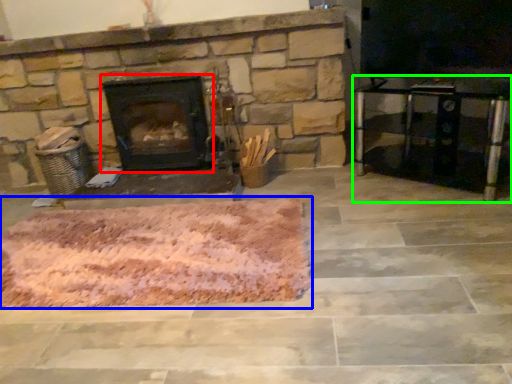
Question: Estimate the real-world distances between objects in this image. Which object is farther from wood burning stove (highlighted by a red box), mat (highlighted by a blue box) or entertainment center (highlighted by a green box)?

Choices:
 (A) mat
 (B) entertainment center

Answer: (B)